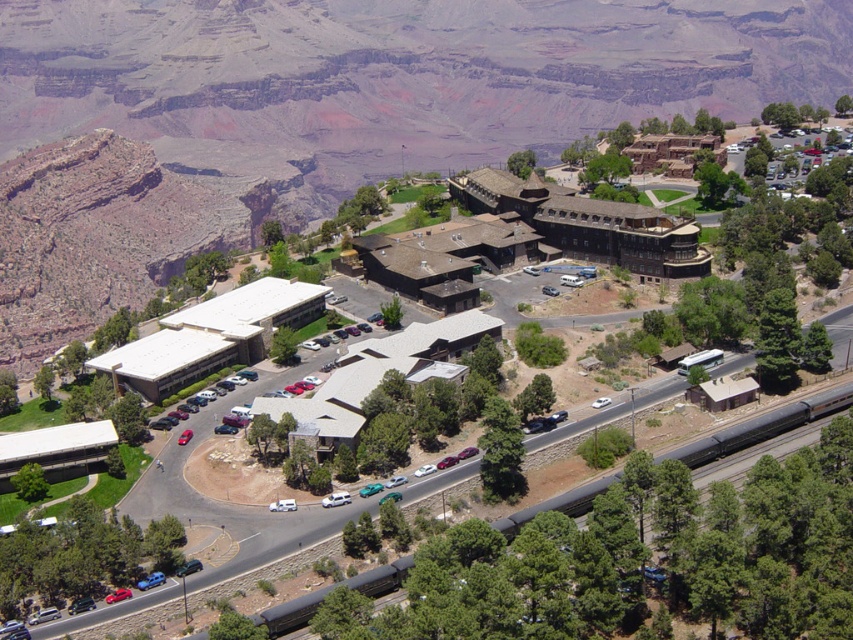
You are a drone operator tasked with capturing aerial footage of the scenic canyon area. You need to position your drone to focus on the brown stone building at center. According to the coordinates provided, where should you direct the drone to ensure it captures the building accurately?

The brown stone building at center is located at the 2D coordinates point (326, 115), so directing the drone to that point will ensure it captures the building accurately.

You are a tourist standing at the edge of the canyon looking towards the buildings. You see the brown stone building at center and the dark gray metallic train track at lower center. Which object is positioned to the left when viewed from your perspective?

The brown stone building at center is to the left of the dark gray metallic train track at lower center from your perspective.